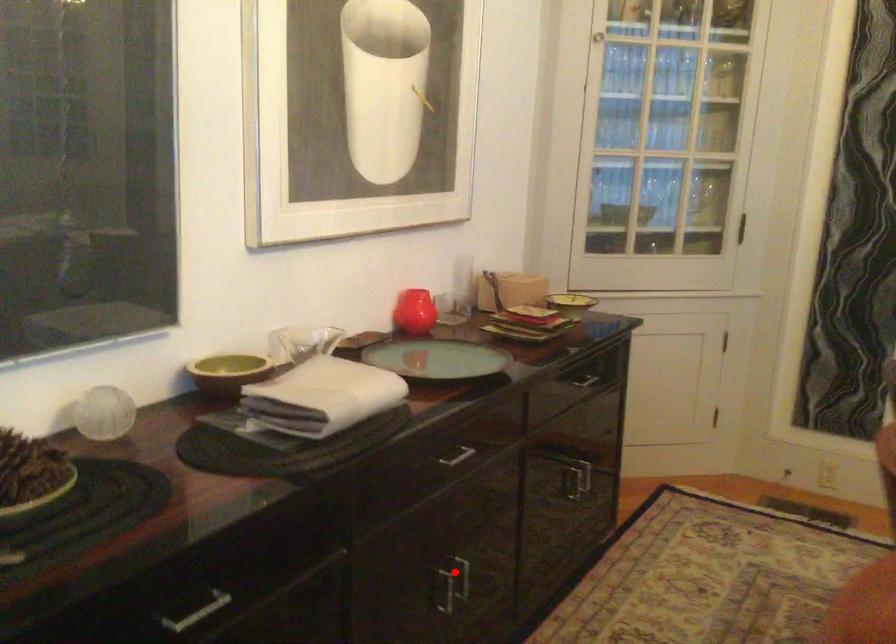
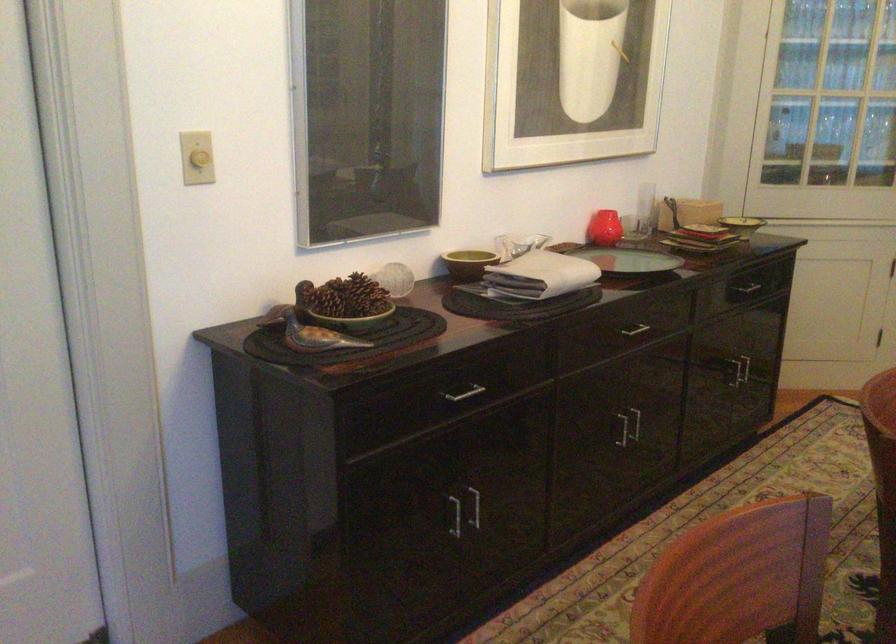
Find the pixel in the second image that matches the highlighted location in the first image.

(635, 422)